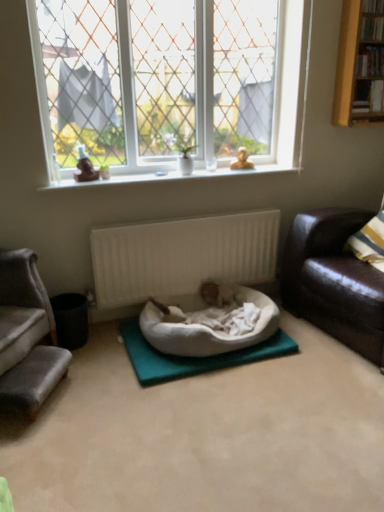
The height and width of the screenshot is (512, 384). What do you see at coordinates (193, 357) in the screenshot? I see `white fabric yoga mat at center` at bounding box center [193, 357].

What do you see at coordinates (30, 338) in the screenshot?
I see `velvet grey couch at left, which is the second studio couch from right to left` at bounding box center [30, 338].

Where is `white matte radiator at center`? white matte radiator at center is located at coordinates (182, 256).

Describe the element at coordinates (167, 82) in the screenshot. This screenshot has height=512, width=384. I see `clear glass window at upper center` at that location.

Locate an element on the screen. white soft dog bed at center is located at coordinates (208, 330).

Image resolution: width=384 pixels, height=512 pixels. What do you see at coordinates (181, 153) in the screenshot?
I see `white ceramic vase at upper center` at bounding box center [181, 153].

You are a GUI agent. You are given a task and a screenshot of the screen. Output one action in this format:
    pyautogui.click(x=<x>, y=<y>)
    Task: Click on the white fabric yoga mat at center
    This screenshot has width=384, height=512.
    Given the screenshot: What is the action you would take?
    pyautogui.click(x=193, y=357)

Considering the sizes of objects clear glass window at upper center and white ceramic vase at upper center in the image provided, who is taller, clear glass window at upper center or white ceramic vase at upper center?

With more height is clear glass window at upper center.

From a real-world perspective, is clear glass window at upper center positioned under white ceramic vase at upper center based on gravity?

No, from a real-world perspective, clear glass window at upper center is not under white ceramic vase at upper center.

From the image's perspective, who appears lower, clear glass window at upper center or white ceramic vase at upper center?

From the image's view, white ceramic vase at upper center is below.

Considering the relative sizes of clear glass window at upper center and white ceramic vase at upper center in the image provided, is clear glass window at upper center wider than white ceramic vase at upper center?

Indeed, clear glass window at upper center has a greater width compared to white ceramic vase at upper center.

Is white matte radiator at center taller than white soft dog bed at center?

Yes.

Which object is positioned more to the right, white matte radiator at center or white soft dog bed at center?

From the viewer's perspective, white soft dog bed at center appears more on the right side.

Consider the image. Choose the correct answer: Is white matte radiator at center inside white soft dog bed at center or outside it?

white matte radiator at center exists outside the volume of white soft dog bed at center.

Does white matte radiator at center come in front of white soft dog bed at center?

No.

Considering the positions of objects shiny brown leather couch at right, which is the 2th studio couch in left-to-right order, and white soft dog bed at center in the image provided, who is behind, shiny brown leather couch at right, which is the 2th studio couch in left-to-right order, or white soft dog bed at center?

white soft dog bed at center is further away from the camera.

Is shiny brown leather couch at right, which is the 2th studio couch in left-to-right order, oriented away from white soft dog bed at center?

That's not correct — shiny brown leather couch at right, which is the 2th studio couch in left-to-right order, is not looking away from white soft dog bed at center.

From the image's perspective, is shiny brown leather couch at right, the first studio couch from the right, above or below white soft dog bed at center?

shiny brown leather couch at right, the first studio couch from the right, is above white soft dog bed at center.

Where is `cabinetry above the white ceramic vase at upper center (from the image's perspective)`? cabinetry above the white ceramic vase at upper center (from the image's perspective) is located at coordinates (360, 64).

From a real-world perspective, is yellow wood bookshelf at upper right physically located above or below white ceramic vase at upper center?

yellow wood bookshelf at upper right is above white ceramic vase at upper center.

Which object is closer to the camera, yellow wood bookshelf at upper right or white ceramic vase at upper center?

yellow wood bookshelf at upper right.

Is yellow wood bookshelf at upper right smaller than white ceramic vase at upper center?

No, yellow wood bookshelf at upper right is not smaller than white ceramic vase at upper center.

From the picture: Between white fabric yoga mat at center and clear glass window at upper center, which one appears on the left side from the viewer's perspective?

Positioned to the left is clear glass window at upper center.

From a real-world perspective, is white fabric yoga mat at center on clear glass window at upper center?

No.

Considering the relative sizes of white fabric yoga mat at center and clear glass window at upper center in the image provided, is white fabric yoga mat at center bigger than clear glass window at upper center?

Incorrect, white fabric yoga mat at center is not larger than clear glass window at upper center.

Is white fabric yoga mat at center shorter than clear glass window at upper center?

Yes, white fabric yoga mat at center is shorter than clear glass window at upper center.

Between yellow wood bookshelf at upper right and white soft dog bed at center, which one has smaller width?

Thinner between the two is yellow wood bookshelf at upper right.

Considering the points (382, 113) and (201, 339), which point is behind, point (382, 113) or point (201, 339)?

The point (382, 113) is behind.

From the image's perspective, does yellow wood bookshelf at upper right appear lower than white soft dog bed at center?

No, from the image's perspective, yellow wood bookshelf at upper right is not below white soft dog bed at center.

Based on their sizes in the image, would you say yellow wood bookshelf at upper right is bigger or smaller than white soft dog bed at center?

Clearly, yellow wood bookshelf at upper right is smaller in size than white soft dog bed at center.

In the scene shown: Could you tell me if white matte radiator at center is turned towards white fabric yoga mat at center?

No.

Based on their positions, is white matte radiator at center located to the left or right of white fabric yoga mat at center?

Clearly, white matte radiator at center is on the left of white fabric yoga mat at center in the image.

Can you confirm if white matte radiator at center is wider than white fabric yoga mat at center?

Incorrect, the width of white matte radiator at center does not surpass that of white fabric yoga mat at center.

Which of these two, white matte radiator at center or white fabric yoga mat at center, is smaller?

With smaller size is white fabric yoga mat at center.

Locate an element on the screen. window above the white ceramic vase at upper center (from the image's perspective) is located at coordinates (167, 82).

This screenshot has width=384, height=512. In order to click on radiator that appears on the left of white soft dog bed at center in this screenshot , I will do coord(182,256).

Based on their spatial positions, is white ceramic vase at upper center or shiny brown leather couch at right, which is the 2th studio couch in left-to-right order, further from white matte radiator at center?

white ceramic vase at upper center.

Estimate the real-world distances between objects in this image. Which object is further from white fabric yoga mat at center, clear glass window at upper center or white soft dog bed at center?

Based on the image, clear glass window at upper center appears to be further to white fabric yoga mat at center.

Considering their positions, is white fabric yoga mat at center positioned further to clear glass window at upper center than yellow wood bookshelf at upper right?

white fabric yoga mat at center is positioned further to the anchor clear glass window at upper center.

From the image, which object appears to be farther from white soft dog bed at center, white fabric yoga mat at center or white matte radiator at center?

Based on the image, white matte radiator at center appears to be further to white soft dog bed at center.

Which object lies further to the anchor point clear glass window at upper center, black matte trash bin at lower left or white ceramic vase at upper center?

Based on the image, black matte trash bin at lower left appears to be further to clear glass window at upper center.

Estimate the real-world distances between objects in this image. Which object is closer to black matte trash bin at lower left, velvet grey couch at left, which is the second studio couch from right to left, or white ceramic vase at upper center?

Based on the image, velvet grey couch at left, which is the second studio couch from right to left, appears to be nearer to black matte trash bin at lower left.

Considering their positions, is white ceramic vase at upper center positioned closer to black matte trash bin at lower left than white fabric yoga mat at center?

white fabric yoga mat at center is positioned closer to the anchor black matte trash bin at lower left.

From the image, which object appears to be nearer to white ceramic vase at upper center, velvet grey couch at left, which is the first studio couch from left to right, or yellow wood bookshelf at upper right?

Based on the image, yellow wood bookshelf at upper right appears to be nearer to white ceramic vase at upper center.

In order to click on window situated between black matte trash bin at lower left and shiny brown leather couch at right, the first studio couch from the right, from left to right in this screenshot , I will do `click(167, 82)`.

Identify the location of dog bed between white matte radiator at center and white fabric yoga mat at center in the vertical direction. click(208, 330).

Locate an element on the screen. The width and height of the screenshot is (384, 512). dog bed located between white ceramic vase at upper center and shiny brown leather couch at right, the first studio couch from the right, in the left-right direction is located at coordinates (208, 330).

Locate an element on the screen. Image resolution: width=384 pixels, height=512 pixels. cabinetry between velvet grey couch at left, which is the first studio couch from left to right, and shiny brown leather couch at right, the first studio couch from the right, in the horizontal direction is located at coordinates (360, 64).